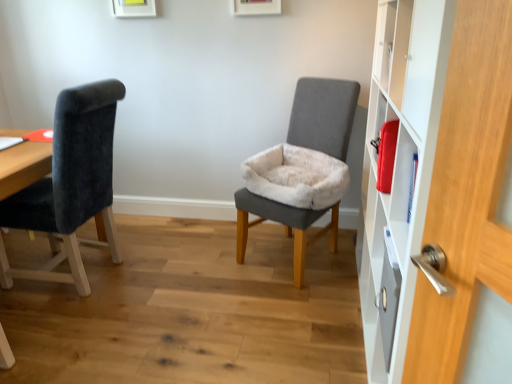
Locate an element on the screen. vacant space that is in between gray fabric chair at center, which is the 2th chair from left to right, and velvet black chair at left, which is the 2th chair in right-to-left order is located at coordinates (194, 266).